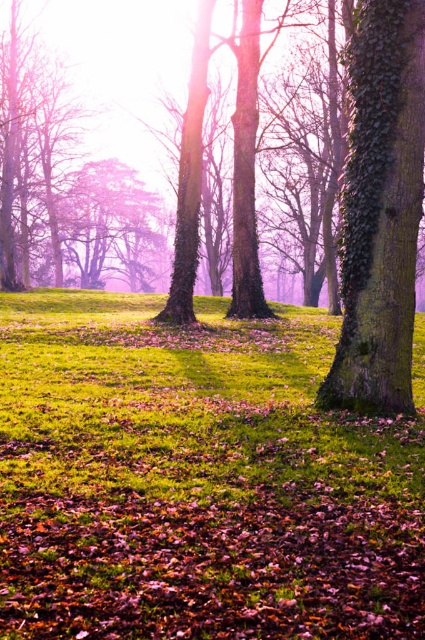
You are standing in the park and want to place a small garden gnome exactly between the green grassy at center and the green mossy tree trunk at center. Based on their positions, where should you place the gnome?

The green grassy at center is located below the green mossy tree trunk at center, so you should place the gnome between them along the vertical axis, positioning it halfway between the grass and the tree trunk.